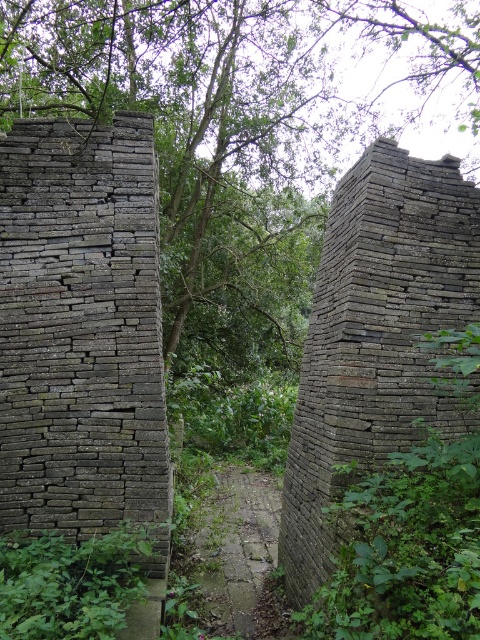
How far apart are weathered stone ruins at right and green leafy plant at center?

weathered stone ruins at right is 6.42 feet away from green leafy plant at center.

Consider the image. Does weathered stone ruins at right appear on the right side of green leafy plant at center?

Correct, you'll find weathered stone ruins at right to the right of green leafy plant at center.

Is point (348, 396) positioned after point (110, 576)?

Yes.

At what (x,y) coordinates should I click in order to perform the action: click on weathered stone ruins at right. Please return your answer as a coordinate pair (x, y). The height and width of the screenshot is (640, 480). Looking at the image, I should click on (375, 337).

Looking at this image, between weathered stone ruins at right and brick pathway at center, which one is positioned lower?

brick pathway at center is below.

Which is more to the right, weathered stone ruins at right or brick pathway at center?

weathered stone ruins at right

What do you see at coordinates (375, 337) in the screenshot?
I see `weathered stone ruins at right` at bounding box center [375, 337].

The image size is (480, 640). I want to click on weathered stone ruins at right, so point(375,337).

Is weathered stone wall at left wider than green leafy plant at center?

Yes.

Does weathered stone wall at left have a lesser height compared to green leafy plant at center?

Incorrect, weathered stone wall at left's height does not fall short of green leafy plant at center's.

Is point (36, 243) positioned before point (153, 525)?

No, (36, 243) is behind (153, 525).

Find the location of `weathered stone wall at left`. weathered stone wall at left is located at coordinates (82, 332).